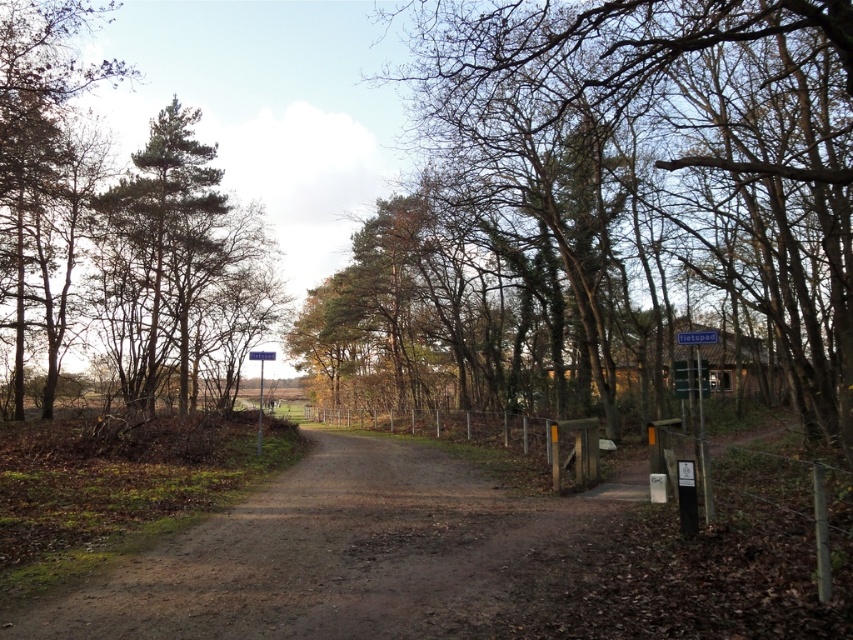
Question: Considering the relative positions of dirt road at center and green needle-like foliage at left in the image provided, where is dirt road at center located with respect to green needle-like foliage at left?

Choices:
 (A) right
 (B) left

Answer: (A)

Question: Which object is the closest to the bare wood tree at center?

Choices:
 (A) green needle-like foliage at left
 (B) dirt road at center
 (C) blue wooden signpost at right
 (D) blue plastic street sign at center

Answer: (C)

Question: Can you confirm if dirt road at center is wider than blue wooden signpost at right?

Choices:
 (A) yes
 (B) no

Answer: (A)

Question: Does blue wooden signpost at right have a smaller size compared to blue plastic street sign at center?

Choices:
 (A) yes
 (B) no

Answer: (A)

Question: Which point appears closest to the camera in this image?

Choices:
 (A) click(202, 253)
 (B) click(706, 476)
 (C) click(491, 52)
 (D) click(398, 609)

Answer: (D)

Question: Which of the following is the farthest from the observer?

Choices:
 (A) 698,403
 (B) 260,356

Answer: (A)